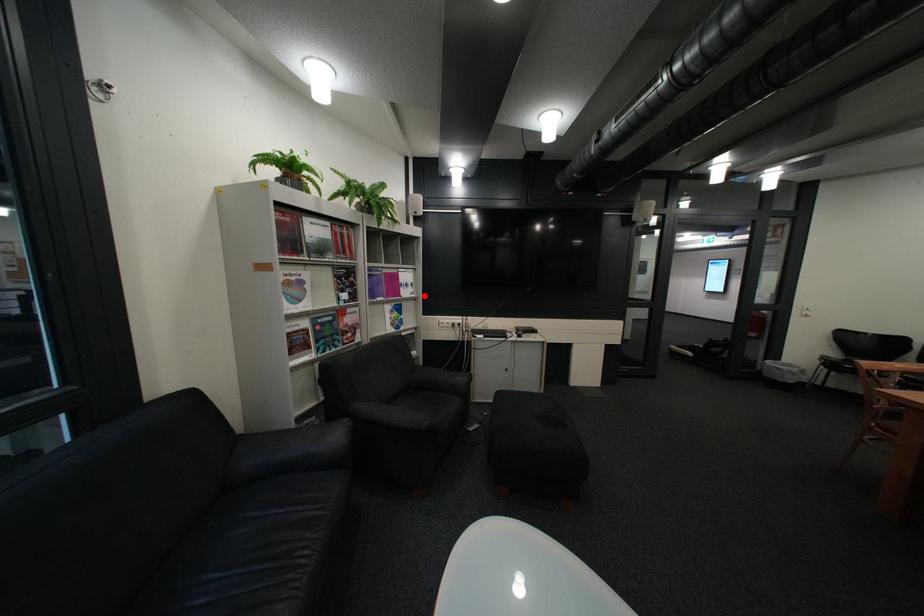
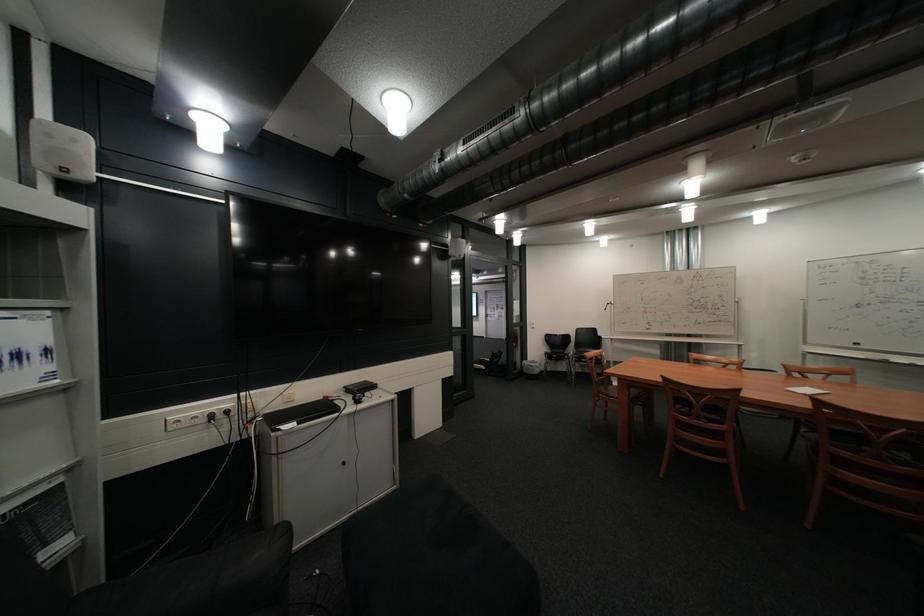
Question: I am providing you with two images of the same scene from different viewpoints. In image1, a red point is highlighted. Considering the same 3D point in image2, which of the following is correct?

Choices:
 (A) It is closer
 (B) It is farther

Answer: (B)